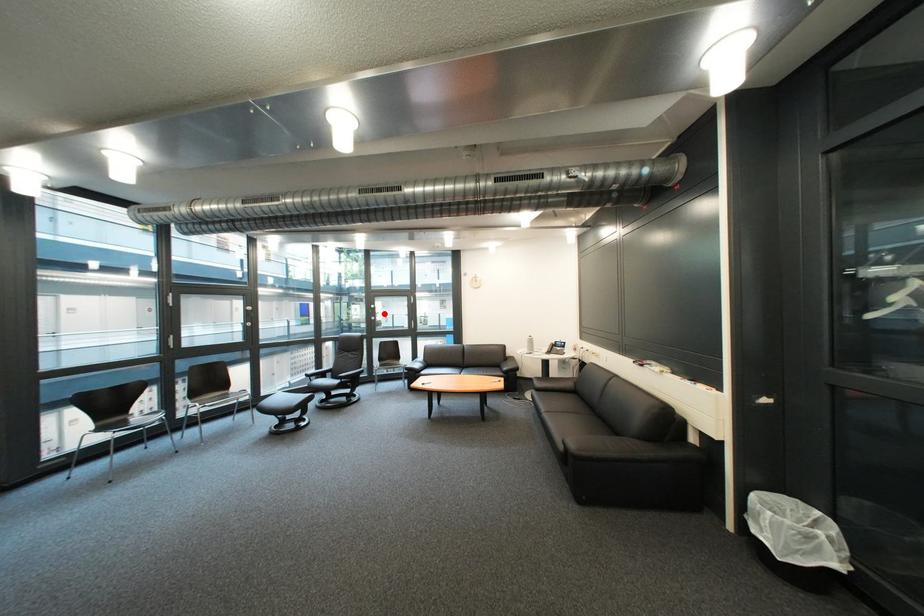
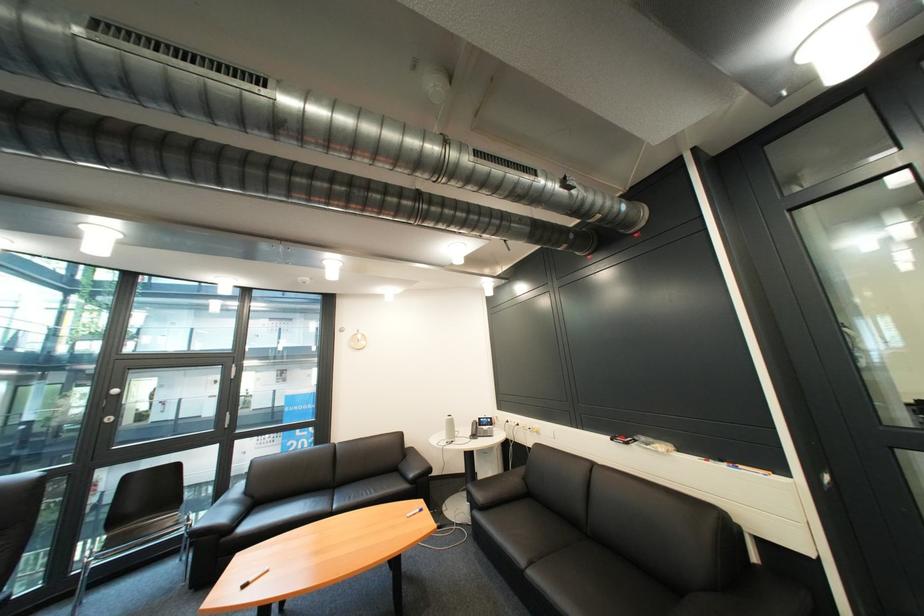
The point at the highlighted location is marked in the first image. Where is the corresponding point in the second image?

(118, 408)